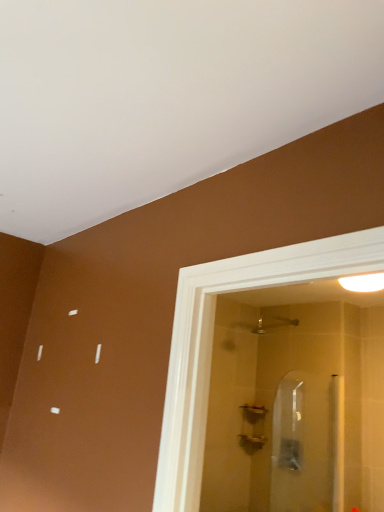
Question: In the image, is matte silver showerhead at upper center positioned in front of or behind clear glass screen door at center?

Choices:
 (A) behind
 (B) front

Answer: (A)

Question: Would you say matte silver showerhead at upper center is to the left or to the right of clear glass screen door at center in the picture?

Choices:
 (A) right
 (B) left

Answer: (B)

Question: Based on their relative distances, which object is nearer to the matte silver showerhead at upper center?

Choices:
 (A) clear glass screen door at center
 (B) white glossy light fixture at upper right

Answer: (A)

Question: Which of these objects is positioned closest to the white glossy light fixture at upper right?

Choices:
 (A) matte silver showerhead at upper center
 (B) clear glass screen door at center

Answer: (A)